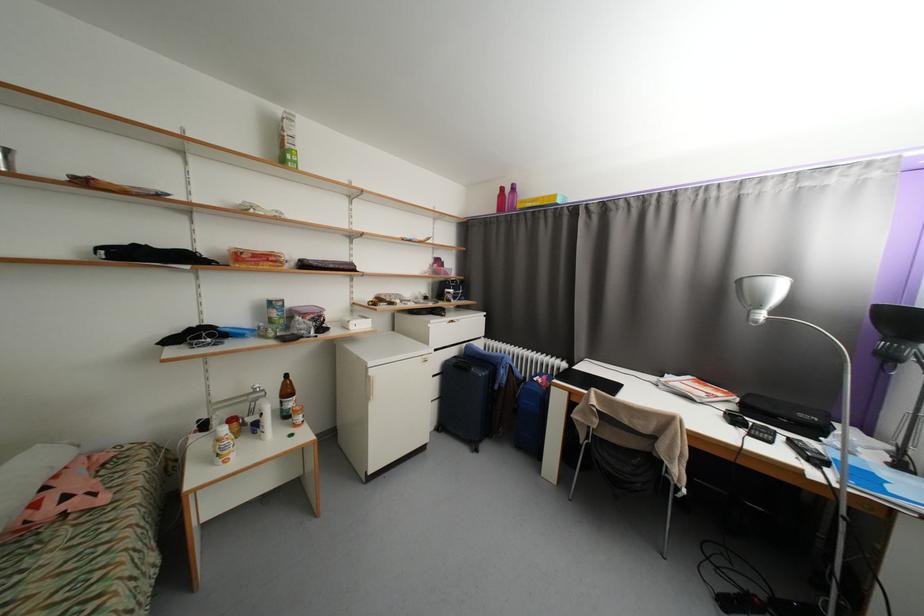
Find the location of a particular element. The height and width of the screenshot is (616, 924). refrigerator door handle is located at coordinates (370, 387).